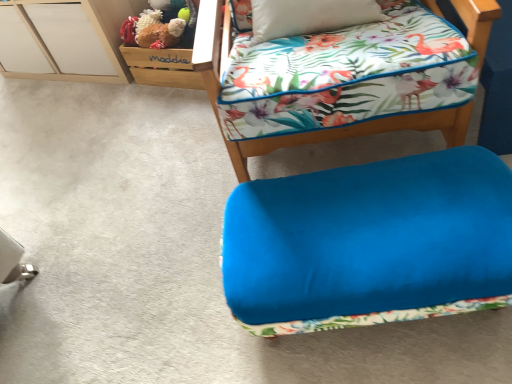
Question: Is the position of velvet blue ottoman at lower center, arranged as the 1th furniture when viewed from the top, more distant than that of fluffy brown teddy bear at upper left?

Choices:
 (A) no
 (B) yes

Answer: (A)

Question: Considering the relative sizes of velvet blue ottoman at lower center, arranged as the 1th furniture when viewed from the top, and fluffy brown teddy bear at upper left in the image provided, is velvet blue ottoman at lower center, arranged as the 1th furniture when viewed from the top, bigger than fluffy brown teddy bear at upper left?

Choices:
 (A) no
 (B) yes

Answer: (B)

Question: From a real-world perspective, is velvet blue ottoman at lower center, arranged as the 1th furniture when viewed from the top, positioned over fluffy brown teddy bear at upper left based on gravity?

Choices:
 (A) yes
 (B) no

Answer: (A)

Question: Is velvet blue ottoman at lower center, which appears as the 2th furniture when ordered from the bottom, outside of fluffy brown teddy bear at upper left?

Choices:
 (A) no
 (B) yes

Answer: (B)

Question: Can you confirm if velvet blue ottoman at lower center, arranged as the 1th furniture when viewed from the top, is thinner than fluffy brown teddy bear at upper left?

Choices:
 (A) no
 (B) yes

Answer: (A)

Question: From a real-world perspective, is velvet blue ottoman at lower right, the 2th furniture viewed from the top, above or below velvet blue ottoman at lower center, arranged as the 1th furniture when viewed from the top?

Choices:
 (A) below
 (B) above

Answer: (A)

Question: From the image's perspective, relative to velvet blue ottoman at lower center, arranged as the 1th furniture when viewed from the top, is velvet blue ottoman at lower right, which appears as the first furniture when ordered from the bottom, above or below?

Choices:
 (A) below
 (B) above

Answer: (A)

Question: Is velvet blue ottoman at lower right, the 2th furniture viewed from the top, taller or shorter than velvet blue ottoman at lower center, arranged as the 1th furniture when viewed from the top?

Choices:
 (A) tall
 (B) short

Answer: (B)

Question: Is velvet blue ottoman at lower right, which appears as the first furniture when ordered from the bottom, situated inside velvet blue ottoman at lower center, arranged as the 1th furniture when viewed from the top, or outside?

Choices:
 (A) inside
 (B) outside

Answer: (B)

Question: From the image's perspective, is fluffy brown teddy bear at upper left positioned above or below velvet blue ottoman at lower center, which appears as the 2th furniture when ordered from the bottom?

Choices:
 (A) above
 (B) below

Answer: (A)

Question: In terms of height, does fluffy brown teddy bear at upper left look taller or shorter compared to velvet blue ottoman at lower center, arranged as the 1th furniture when viewed from the top?

Choices:
 (A) tall
 (B) short

Answer: (B)

Question: Considering the positions of point (175, 29) and point (352, 134), is point (175, 29) closer or farther from the camera than point (352, 134)?

Choices:
 (A) closer
 (B) farther

Answer: (B)

Question: Relative to velvet blue ottoman at lower center, which appears as the 2th furniture when ordered from the bottom, is fluffy brown teddy bear at upper left in front or behind?

Choices:
 (A) behind
 (B) front

Answer: (A)

Question: Choose the correct answer: Is velvet blue ottoman at lower center, arranged as the 1th furniture when viewed from the top, inside fluffy brown teddy bear at upper left or outside it?

Choices:
 (A) inside
 (B) outside

Answer: (B)

Question: From a real-world perspective, is velvet blue ottoman at lower center, arranged as the 1th furniture when viewed from the top, above or below fluffy brown teddy bear at upper left?

Choices:
 (A) above
 (B) below

Answer: (A)